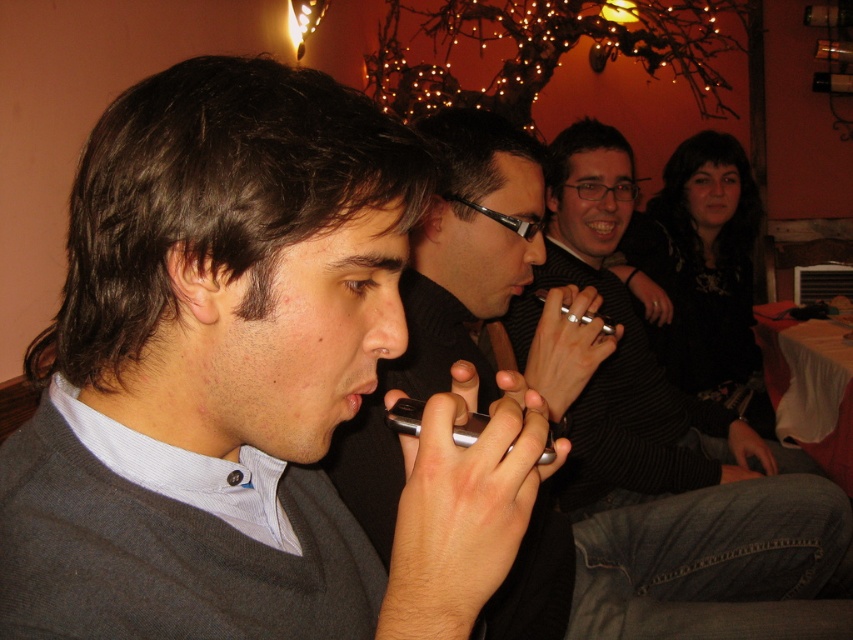
Question: Which of the following is the farthest from the observer?

Choices:
 (A) silver metallic smartphone at center
 (B) gray matte sweater at center
 (C) metallic silver phone at center
 (D) pink matte lips at center

Answer: (A)

Question: Estimate the real-world distances between objects in this image. Which object is farther from the metallic silver phone at center?

Choices:
 (A) silver metallic smartphone at center
 (B) black textured sweater at center

Answer: (A)

Question: Can you confirm if gray matte sweater at center is wider than metallic silver phone at center?

Choices:
 (A) no
 (B) yes

Answer: (A)

Question: Is metallic silver phone at center to the left of black textured sweater at center from the viewer's perspective?

Choices:
 (A) no
 (B) yes

Answer: (B)

Question: Which object is positioned farthest from the metallic silver phone at center?

Choices:
 (A) pink matte lips at center
 (B) black textured sweater at center
 (C) gray matte sweater at center

Answer: (A)

Question: Is gray matte sweater at center bigger than metallic silver phone at center?

Choices:
 (A) yes
 (B) no

Answer: (B)